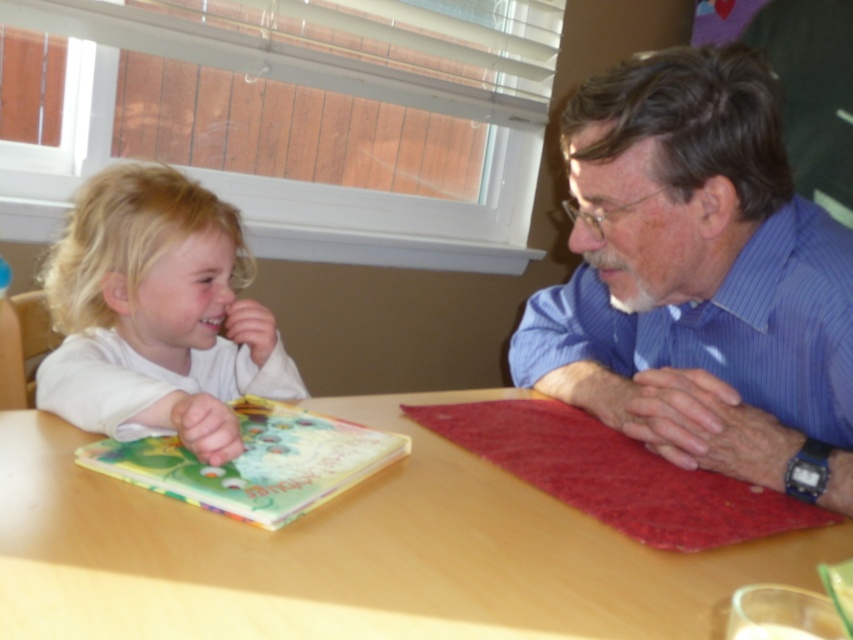
Question: Can you confirm if blue striped shirt at upper right is positioned below white matte hair at left?

Choices:
 (A) yes
 (B) no

Answer: (B)

Question: Estimate the real-world distances between objects in this image. Which object is farther from the hardcover book at center?

Choices:
 (A) blue striped shirt at upper right
 (B) white matte hair at left

Answer: (A)

Question: Which is farther from the blue striped shirt at upper right?

Choices:
 (A) hardcover book at center
 (B) white matte hair at left
 (C) wooden table at center

Answer: (B)

Question: Does wooden table at center appear on the left side of hardcover book at center?

Choices:
 (A) yes
 (B) no

Answer: (B)

Question: Is white matte hair at left wider than hardcover book at center?

Choices:
 (A) yes
 (B) no

Answer: (A)

Question: Which of the following is the closest to the observer?

Choices:
 (A) white matte hair at left
 (B) blue striped shirt at upper right
 (C) hardcover book at center
 (D) wooden table at center

Answer: (D)